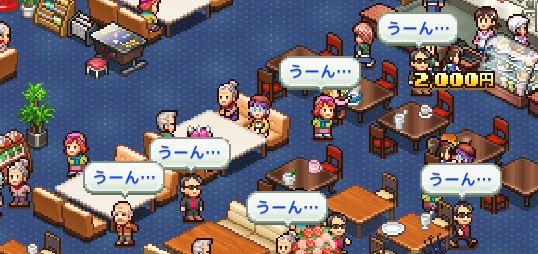
Find the location of `plate`. plate is located at coordinates (391, 236).